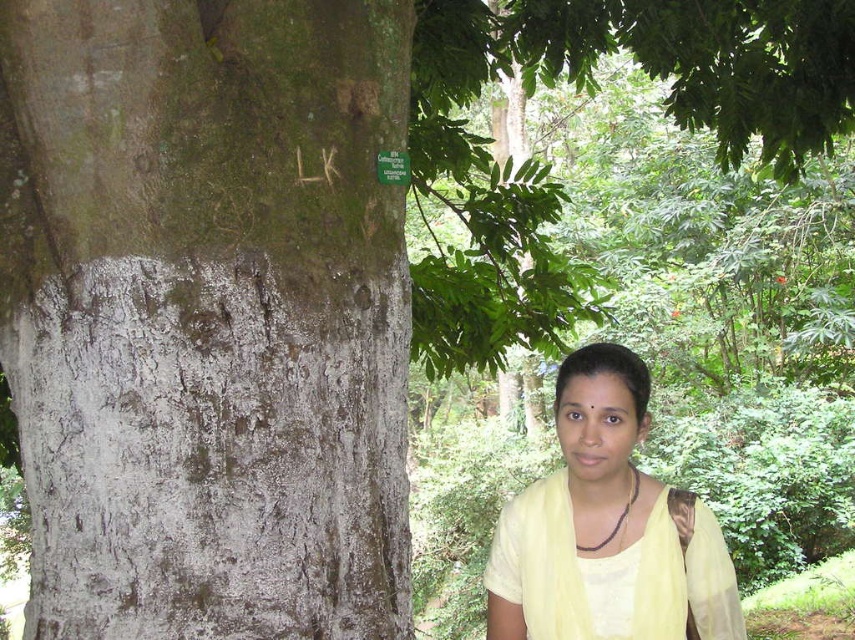
Question: Can you confirm if green rough bark at left is positioned to the left of yellow sheer fabric at lower right?

Choices:
 (A) yes
 (B) no

Answer: (A)

Question: Which of the following is the closest to the observer?

Choices:
 (A) (134, 76)
 (B) (720, 627)

Answer: (A)

Question: Which of the following is the closest to the observer?

Choices:
 (A) (86, 275)
 (B) (567, 426)

Answer: (A)

Question: Is green rough bark at left closer to camera compared to yellow sheer fabric at lower right?

Choices:
 (A) yes
 (B) no

Answer: (A)

Question: In this image, where is green rough bark at left located relative to yellow sheer fabric at lower right?

Choices:
 (A) left
 (B) right

Answer: (A)

Question: Among these points, which one is nearest to the camera?

Choices:
 (A) (220, 36)
 (B) (502, 588)

Answer: (A)